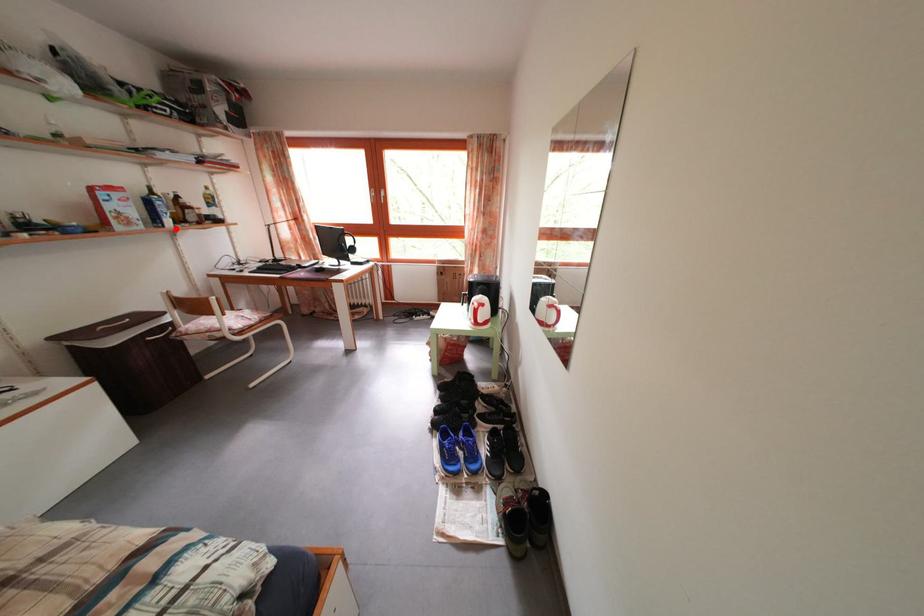
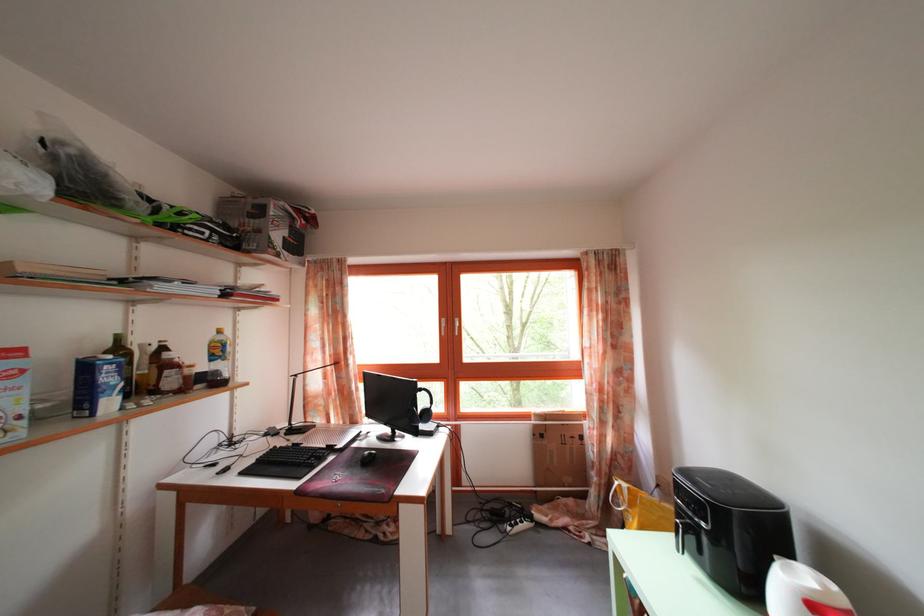
Question: I am providing you with two images of the same scene from different viewpoints. A red point is marked on the first image. Is the red point's position out of view in image 2?

Choices:
 (A) Yes
 (B) No

Answer: (B)